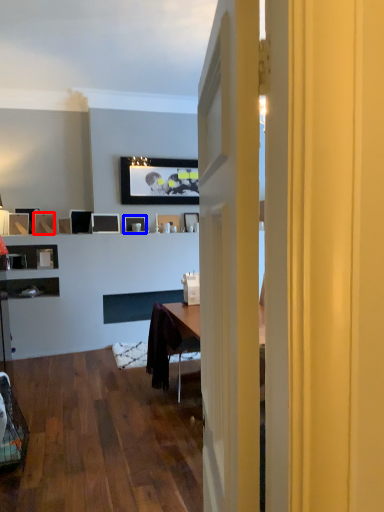
Question: Which object appears closest to the camera in this image, picture frame (highlighted by a red box) or picture frame (highlighted by a blue box)?

Choices:
 (A) picture frame
 (B) picture frame

Answer: (A)